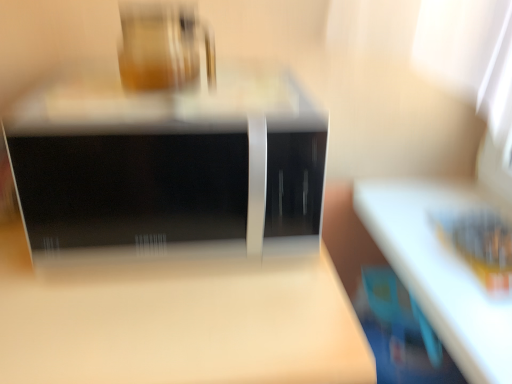
Question: Does matte glass jar at upper center come behind black glossy microwave at center?

Choices:
 (A) no
 (B) yes

Answer: (B)

Question: Is matte glass jar at upper center taller than black glossy microwave at center?

Choices:
 (A) yes
 (B) no

Answer: (B)

Question: From the image's perspective, is matte glass jar at upper center on black glossy microwave at center?

Choices:
 (A) no
 (B) yes

Answer: (B)

Question: Considering the relative sizes of matte glass jar at upper center and black glossy microwave at center in the image provided, is matte glass jar at upper center shorter than black glossy microwave at center?

Choices:
 (A) no
 (B) yes

Answer: (B)

Question: Would you say matte glass jar at upper center is a long distance from black glossy microwave at center?

Choices:
 (A) no
 (B) yes

Answer: (A)

Question: Based on their sizes in the image, would you say matte glass jar at upper center is bigger or smaller than matte wood table at center?

Choices:
 (A) small
 (B) big

Answer: (A)

Question: Visually, is matte glass jar at upper center positioned to the left or to the right of matte wood table at center?

Choices:
 (A) left
 (B) right

Answer: (B)

Question: Is matte glass jar at upper center inside or outside of matte wood table at center?

Choices:
 (A) inside
 (B) outside

Answer: (B)

Question: From a real-world perspective, is matte glass jar at upper center physically located above or below matte wood table at center?

Choices:
 (A) above
 (B) below

Answer: (A)

Question: Which is correct: matte wood table at center is inside black glossy microwave at center, or outside of it?

Choices:
 (A) outside
 (B) inside

Answer: (A)

Question: Would you say matte wood table at center is to the left or to the right of black glossy microwave at center in the picture?

Choices:
 (A) left
 (B) right

Answer: (A)

Question: From a real-world perspective, relative to black glossy microwave at center, is matte wood table at center vertically above or below?

Choices:
 (A) above
 (B) below

Answer: (B)

Question: From the image's perspective, is matte wood table at center above or below black glossy microwave at center?

Choices:
 (A) above
 (B) below

Answer: (B)

Question: Relative to matte glass jar at upper center, is matte wood table at center in front or behind?

Choices:
 (A) front
 (B) behind

Answer: (A)

Question: Considering the positions of matte wood table at center and matte glass jar at upper center in the image, is matte wood table at center taller or shorter than matte glass jar at upper center?

Choices:
 (A) short
 (B) tall

Answer: (B)